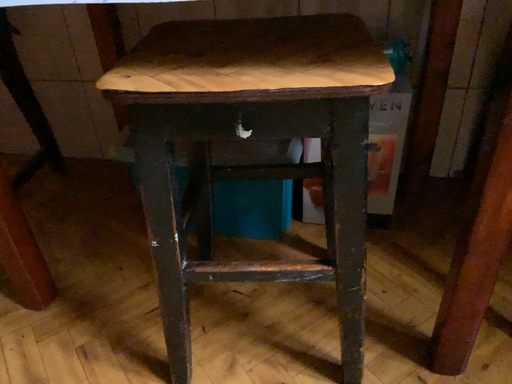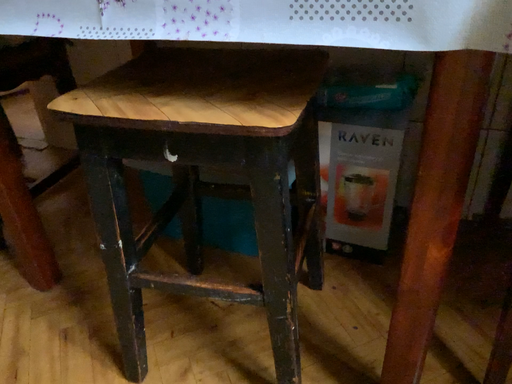
Question: Which way did the camera rotate in the video?

Choices:
 (A) rotated left
 (B) rotated right

Answer: (A)